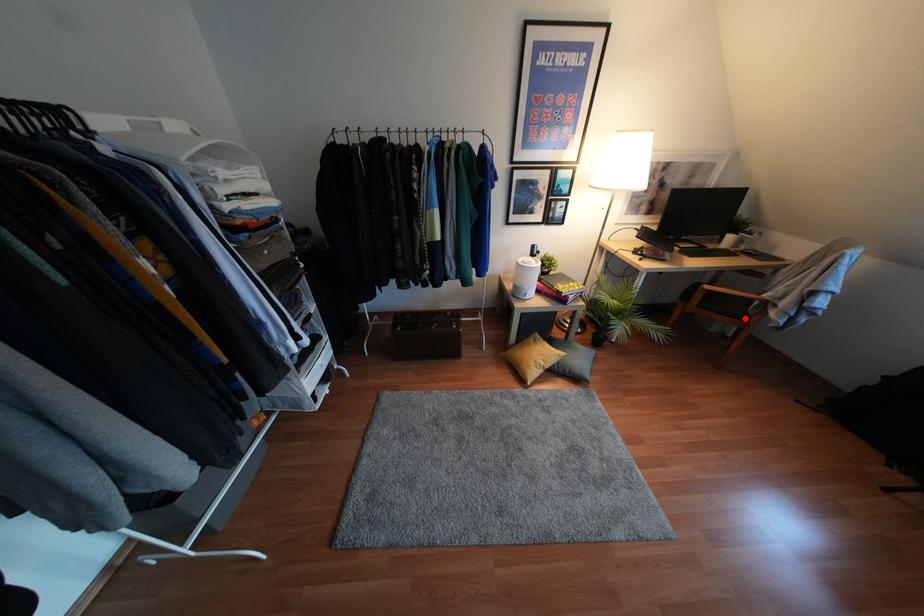
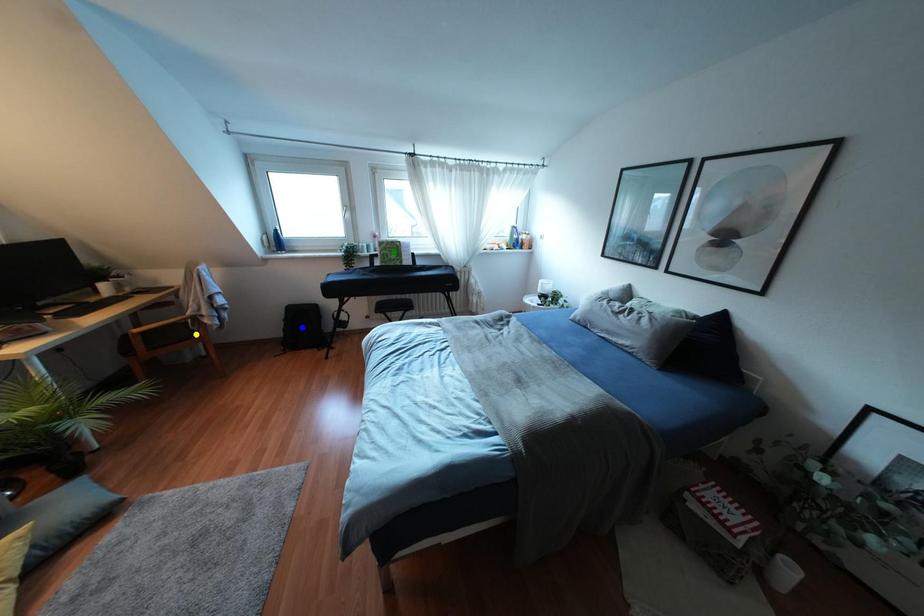
Question: I am providing you with two images of the same scene from different viewpoints. A red point is marked on the first image. You are given multiple points on the second image. Can you choose the point in image 2 that corresponds to the point in image 1?

Choices:
 (A) blue point
 (B) green point
 (C) yellow point

Answer: (C)